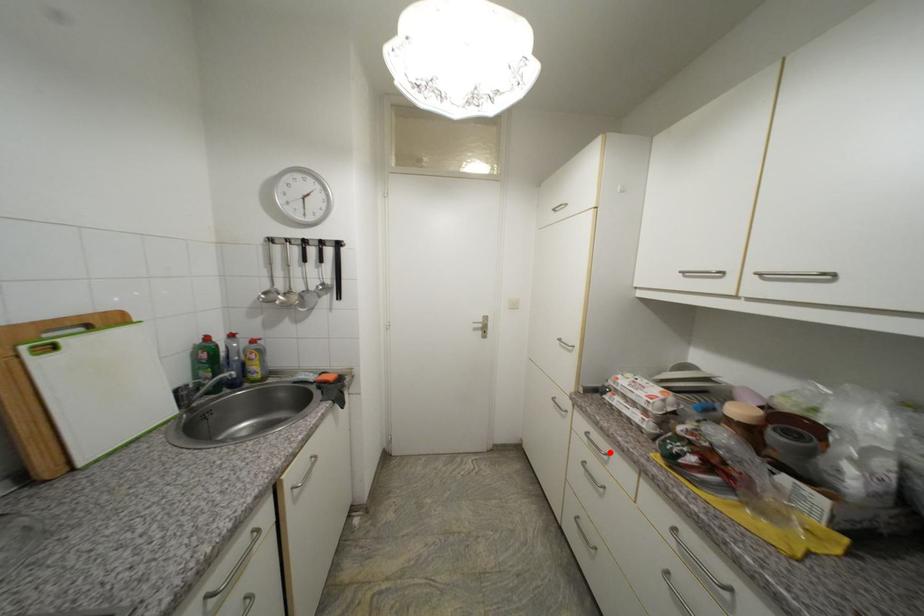
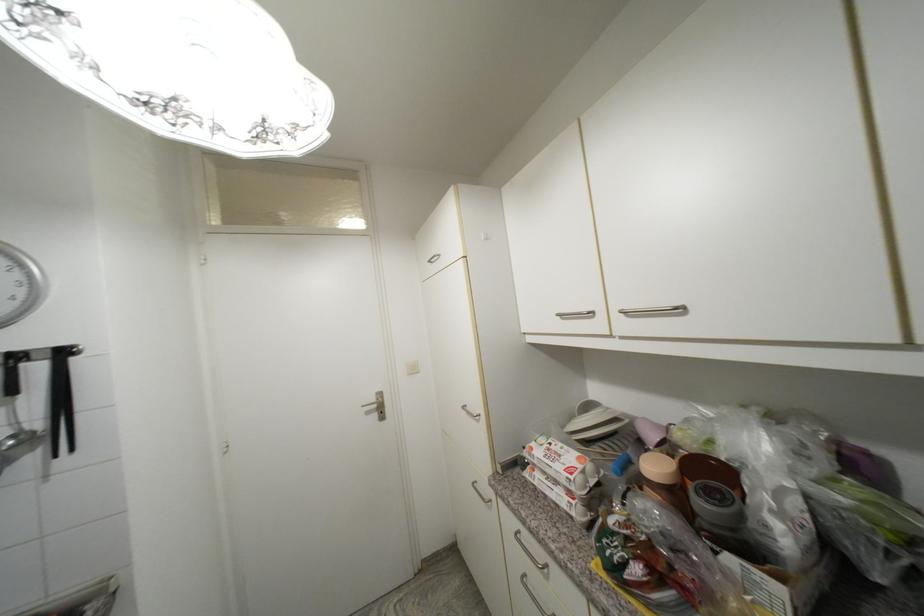
In the second image, find the point that corresponds to the highlighted location in the first image.

(546, 562)